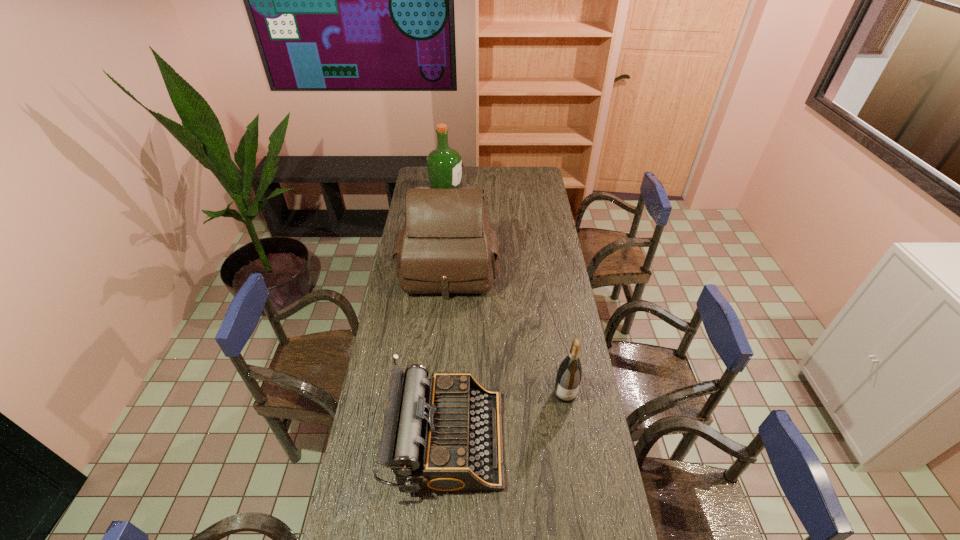
Find the location of `vacant space in between the satchel and the typewriter`. vacant space in between the satchel and the typewriter is located at coordinates (448, 354).

Identify the location of vacant area that lies between the second farthest object and the shortest object. The image size is (960, 540). (448, 354).

In order to click on vacant region between the shortest object and the third nearest object in this screenshot , I will do `click(448, 354)`.

Where is `vacant space in between the shortest object and the satchel`? The width and height of the screenshot is (960, 540). vacant space in between the shortest object and the satchel is located at coordinates (448, 354).

Identify the location of empty space between the second shortest object and the third nearest object. (507, 332).

Image resolution: width=960 pixels, height=540 pixels. Find the location of `the closest object to the second shortest object`. the closest object to the second shortest object is located at coordinates (444, 434).

You are a GUI agent. You are given a task and a screenshot of the screen. Output one action in this format:
    pyautogui.click(x=<x>, y=<y>)
    Task: Click on the object that is the nearest to the third tallest object
    
    Given the screenshot: What is the action you would take?
    (x=444, y=434)

I want to click on vacant area that satisfies the following two spatial constraints: 1. on the label of the rightmost object; 2. on the keyboard of the typewriter, so click(572, 439).

You are a GUI agent. You are given a task and a screenshot of the screen. Output one action in this format:
    pyautogui.click(x=<x>, y=<y>)
    Task: Click on the vacant area that satisfies the following two spatial constraints: 1. on the label of the wine bottle; 2. on the keyboard of the shortest object
    Image resolution: width=960 pixels, height=540 pixels.
    Given the screenshot: What is the action you would take?
    pyautogui.click(x=572, y=439)